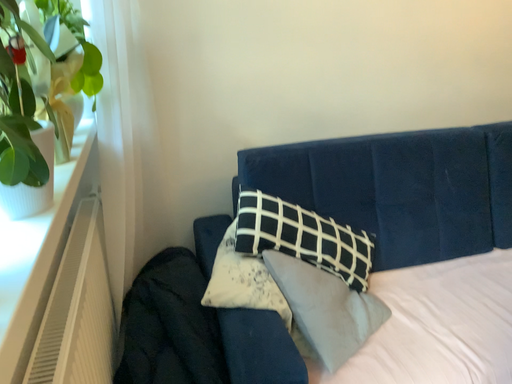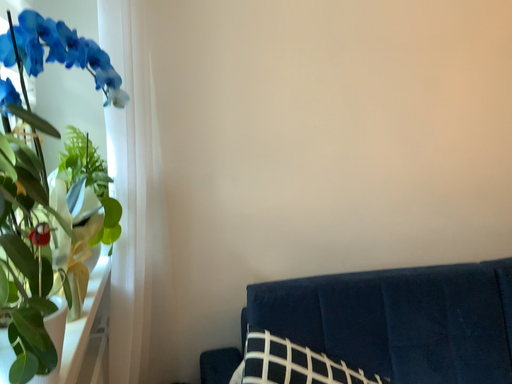
Question: How did the camera likely rotate when shooting the video?

Choices:
 (A) rotated downward
 (B) rotated upward

Answer: (B)